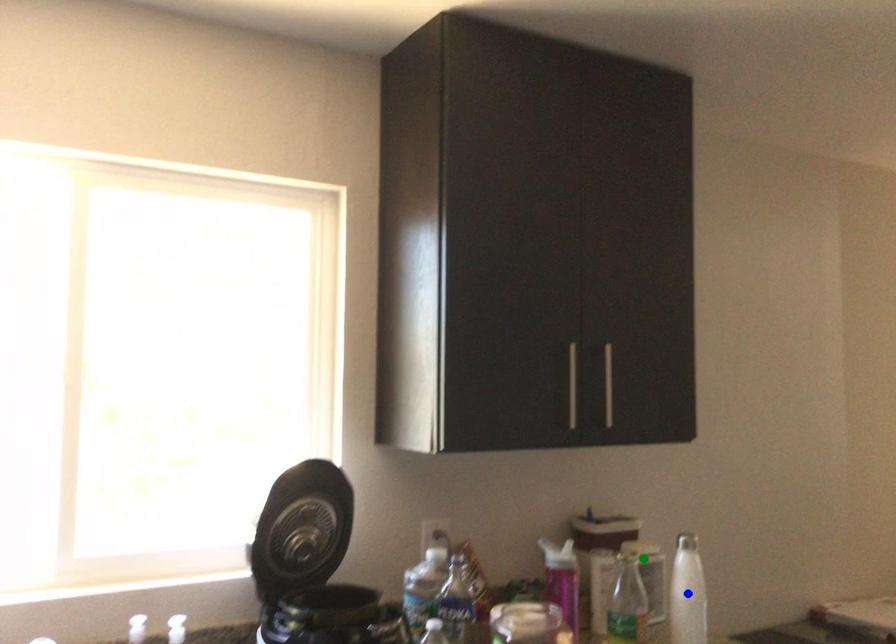
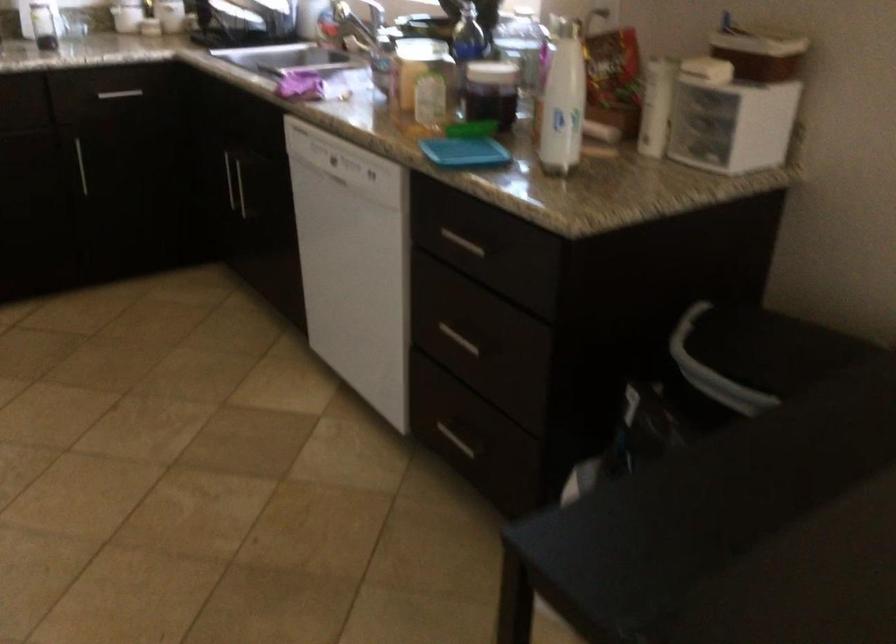
I am providing you with two images of the same scene from different viewpoints. Three points are marked in image1. Which point corresponds to a part or object that is occluded in image2?In image1, three points are marked. Which of them correspond to a part or object that is occluded in image2?Among the three points shown in image1, which one corresponds to a part or object that is no longer visible due to occlusion in image2?

yellow point, blue point